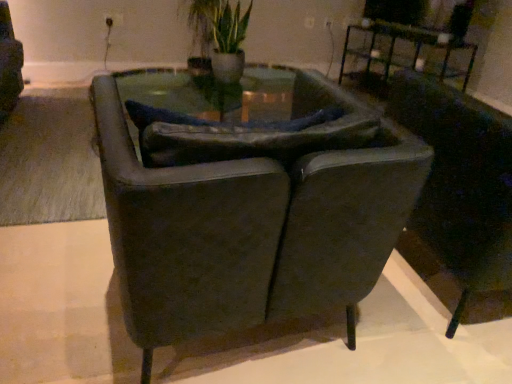
From the picture: Measure the distance between dark leather chair at right, the second chair in the left-to-right sequence, and camera.

The depth of dark leather chair at right, the second chair in the left-to-right sequence, is 3.64 feet.

Find the location of a particular element. Image resolution: width=512 pixels, height=384 pixels. metallic black table at upper right is located at coordinates click(408, 53).

Looking at this image, can you confirm if suede-like dark brown armchair at center, the second chair positioned from the right, is shorter than dark leather chair at right, the second chair in the left-to-right sequence?

No.

Which of these two, suede-like dark brown armchair at center, the first chair viewed from the left, or dark leather chair at right, which ranks as the 1th chair in right-to-left order, is bigger?

dark leather chair at right, which ranks as the 1th chair in right-to-left order.

Is the position of suede-like dark brown armchair at center, the first chair viewed from the left, more distant than that of dark leather chair at right, the second chair in the left-to-right sequence?

No.

Is suede-like dark brown armchair at center, the first chair viewed from the left, positioned with its back to dark leather chair at right, the second chair in the left-to-right sequence?

No, suede-like dark brown armchair at center, the first chair viewed from the left, is not facing away from dark leather chair at right, the second chair in the left-to-right sequence.

Is dark leather chair at right, which ranks as the 1th chair in right-to-left order, to the left of green leafy plant at upper center from the viewer's perspective?

No.

Is dark leather chair at right, which ranks as the 1th chair in right-to-left order, positioned with its back to green leafy plant at upper center?

That's not correct — dark leather chair at right, which ranks as the 1th chair in right-to-left order, is not looking away from green leafy plant at upper center.

From a real-world perspective, between dark leather chair at right, the second chair in the left-to-right sequence, and green leafy plant at upper center, who is vertically lower?

dark leather chair at right, the second chair in the left-to-right sequence.

Is point (498, 135) positioned after point (234, 73)?

No, it is not.

Is point (474, 111) positioned in front of point (394, 44)?

Yes, point (474, 111) is in front of point (394, 44).

Which is more to the right, dark leather chair at right, the second chair in the left-to-right sequence, or metallic black table at upper right?

Positioned to the right is metallic black table at upper right.

Considering the sizes of objects suede-like dark brown armchair at center, the second chair positioned from the right, and green leafy plant at upper center in the image provided, who is bigger, suede-like dark brown armchair at center, the second chair positioned from the right, or green leafy plant at upper center?

Bigger between the two is suede-like dark brown armchair at center, the second chair positioned from the right.

Could you tell me if suede-like dark brown armchair at center, the second chair positioned from the right, is facing green leafy plant at upper center?

Yes, suede-like dark brown armchair at center, the second chair positioned from the right, is aimed at green leafy plant at upper center.

Which is behind, point (411, 189) or point (230, 39)?

Positioned behind is point (230, 39).

The width and height of the screenshot is (512, 384). Find the location of `the 2nd chair below the green leafy plant at upper center (from the image's perspective)`. the 2nd chair below the green leafy plant at upper center (from the image's perspective) is located at coordinates (248, 203).

Would you say suede-like dark brown armchair at center, the first chair viewed from the left, is part of green leafy plant at upper center's contents?

No.

Are green leafy plant at upper center and suede-like dark brown armchair at center, the first chair viewed from the left, far apart?

Indeed, green leafy plant at upper center is not near suede-like dark brown armchair at center, the first chair viewed from the left.

Is green leafy plant at upper center bigger than suede-like dark brown armchair at center, the first chair viewed from the left?

No.

Can you tell me how much green leafy plant at upper center and dark leather chair at right, the second chair in the left-to-right sequence, differ in facing direction?

180 degrees separate the facing orientations of green leafy plant at upper center and dark leather chair at right, the second chair in the left-to-right sequence.

Is the depth of green leafy plant at upper center greater than that of dark leather chair at right, the second chair in the left-to-right sequence?

Yes, the depth of green leafy plant at upper center is greater than that of dark leather chair at right, the second chair in the left-to-right sequence.

Is green leafy plant at upper center outside of dark leather chair at right, the second chair in the left-to-right sequence?

Indeed, green leafy plant at upper center is completely outside dark leather chair at right, the second chair in the left-to-right sequence.

Looking at this image, is green leafy plant at upper center shorter than dark leather chair at right, the second chair in the left-to-right sequence?

Yes.

In the scene shown: Is metallic black table at upper right turned away from green leafy plant at upper center?

No, green leafy plant at upper center is not at the back of metallic black table at upper right.

Can you confirm if metallic black table at upper right is positioned to the left of green leafy plant at upper center?

No, metallic black table at upper right is not to the left of green leafy plant at upper center.

Can you tell me how much metallic black table at upper right and green leafy plant at upper center differ in facing direction?

The angular difference between metallic black table at upper right and green leafy plant at upper center is 70 degrees.

Looking at this image, can you confirm if metallic black table at upper right is shorter than green leafy plant at upper center?

Correct, metallic black table at upper right is not as tall as green leafy plant at upper center.

The height and width of the screenshot is (384, 512). Identify the location of chair above the suede-like dark brown armchair at center, the first chair viewed from the left (from a real-world perspective). (461, 183).

From a real-world perspective, which chair is the 1st one underneath the green leafy plant at upper center? Please provide its 2D coordinates.

[(461, 183)]

Looking at the image, which one is located further to metallic black table at upper right, green leafy plant at upper center or suede-like dark brown armchair at center, the second chair positioned from the right?

suede-like dark brown armchair at center, the second chair positioned from the right, lies further to metallic black table at upper right than the other object.

Considering their positions, is metallic black table at upper right positioned further to suede-like dark brown armchair at center, the second chair positioned from the right, than green leafy plant at upper center?

The object further to suede-like dark brown armchair at center, the second chair positioned from the right, is metallic black table at upper right.

From the image, which object appears to be farther from metallic black table at upper right, dark leather chair at right, which ranks as the 1th chair in right-to-left order, or green leafy plant at upper center?

Among the two, dark leather chair at right, which ranks as the 1th chair in right-to-left order, is located further to metallic black table at upper right.

Which object lies further to the anchor point dark leather chair at right, which ranks as the 1th chair in right-to-left order, suede-like dark brown armchair at center, the first chair viewed from the left, or metallic black table at upper right?

Among the two, metallic black table at upper right is located further to dark leather chair at right, which ranks as the 1th chair in right-to-left order.

Looking at the image, which one is located closer to green leafy plant at upper center, dark leather chair at right, the second chair in the left-to-right sequence, or suede-like dark brown armchair at center, the first chair viewed from the left?

Among the two, dark leather chair at right, the second chair in the left-to-right sequence, is located nearer to green leafy plant at upper center.

From the image, which object appears to be nearer to dark leather chair at right, the second chair in the left-to-right sequence, suede-like dark brown armchair at center, the second chair positioned from the right, or green leafy plant at upper center?

suede-like dark brown armchair at center, the second chair positioned from the right, is closer to dark leather chair at right, the second chair in the left-to-right sequence.

Estimate the real-world distances between objects in this image. Which object is closer to metallic black table at upper right, suede-like dark brown armchair at center, the first chair viewed from the left, or green leafy plant at upper center?

green leafy plant at upper center is closer to metallic black table at upper right.

Estimate the real-world distances between objects in this image. Which object is further from green leafy plant at upper center, metallic black table at upper right or dark leather chair at right, which ranks as the 1th chair in right-to-left order?

dark leather chair at right, which ranks as the 1th chair in right-to-left order, is positioned further to the anchor green leafy plant at upper center.

This screenshot has width=512, height=384. What are the coordinates of `table between suede-like dark brown armchair at center, the second chair positioned from the right, and green leafy plant at upper center in the front-back direction` in the screenshot? It's located at (408, 53).

This screenshot has width=512, height=384. I want to click on table located between dark leather chair at right, the second chair in the left-to-right sequence, and green leafy plant at upper center in the depth direction, so click(408, 53).

Locate an element on the screen. This screenshot has height=384, width=512. chair between suede-like dark brown armchair at center, the second chair positioned from the right, and metallic black table at upper right in the front-back direction is located at coordinates (461, 183).

The width and height of the screenshot is (512, 384). Identify the location of chair between suede-like dark brown armchair at center, the first chair viewed from the left, and green leafy plant at upper center, along the z-axis. (461, 183).